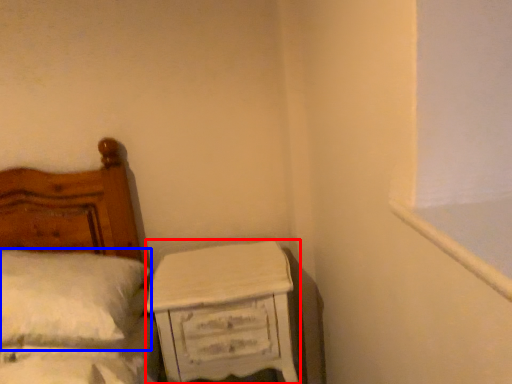
Question: Which of the following is the farthest to the observer, nightstand (highlighted by a red box) or pillow (highlighted by a blue box)?

Choices:
 (A) nightstand
 (B) pillow

Answer: (A)